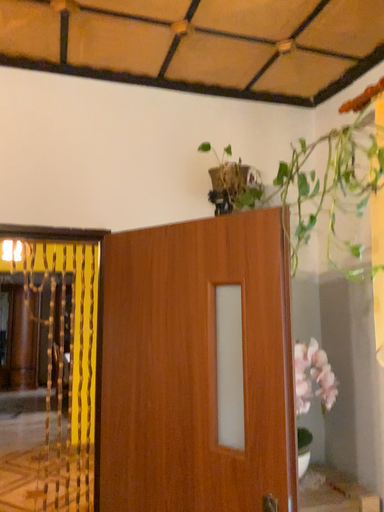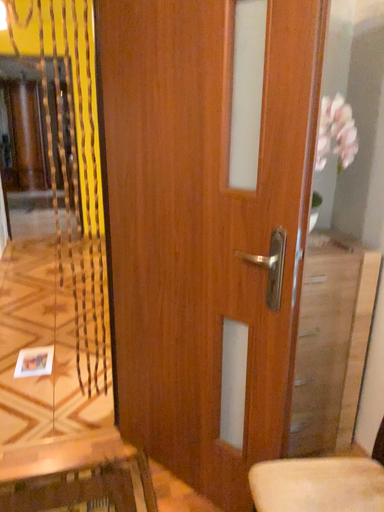
Question: How did the camera likely rotate when shooting the video?

Choices:
 (A) rotated upward
 (B) rotated downward

Answer: (B)